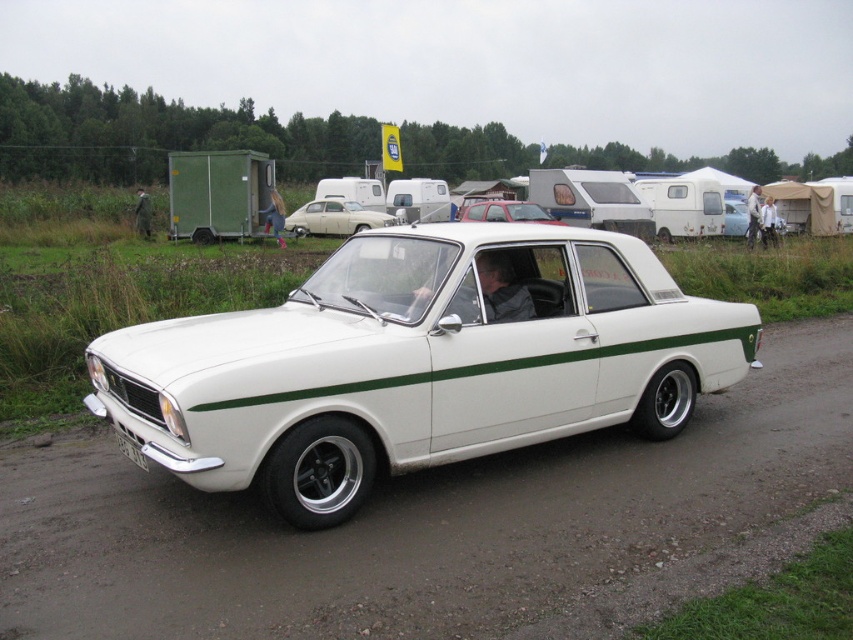
Question: Which object is positioned closest to the white metallic car at center?

Choices:
 (A) white smooth dirt track at center
 (B) matte white car at center
 (C) matte red car at center
 (D) white plastic license plate at lower left

Answer: (D)

Question: Is white smooth dirt track at center further to camera compared to white plastic license plate at lower left?

Choices:
 (A) no
 (B) yes

Answer: (A)

Question: Does matte white car at center have a smaller size compared to matte red car at center?

Choices:
 (A) no
 (B) yes

Answer: (B)

Question: Based on their relative distances, which object is farther from the matte white car at center?

Choices:
 (A) white metallic car at center
 (B) white plastic license plate at lower left
 (C) matte red car at center

Answer: (B)

Question: Can you confirm if matte red car at center is positioned below white plastic license plate at lower left?

Choices:
 (A) yes
 (B) no

Answer: (B)

Question: Which object is the closest to the white plastic license plate at lower left?

Choices:
 (A) white metallic car at center
 (B) matte white car at center
 (C) white smooth dirt track at center

Answer: (A)